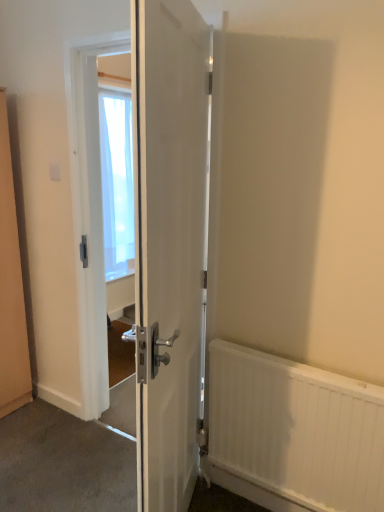
Measure the distance between transparent fabric at center and camera.

The depth of transparent fabric at center is 3.49 meters.

This screenshot has height=512, width=384. What do you see at coordinates (89, 211) in the screenshot?
I see `white glossy door at center` at bounding box center [89, 211].

I want to click on white glossy door at center, so coord(169,243).

What do you see at coordinates (54, 170) in the screenshot?
I see `white plastic electric outlet at upper left` at bounding box center [54, 170].

You are a GUI agent. You are given a task and a screenshot of the screen. Output one action in this format:
    pyautogui.click(x=<x>, y=<y>)
    Task: Click on the transparent fabric at center
    The image size is (384, 512).
    Given the screenshot: What is the action you would take?
    pyautogui.click(x=117, y=183)

Is the position of white glossy door at center less distant than that of white glossy door at center?

No, the depth of white glossy door at center is greater than that of white glossy door at center.

From a real-world perspective, is white glossy door at center physically below white glossy door at center?

No, from a real-world perspective, white glossy door at center is not under white glossy door at center.

Would you say white glossy door at center is a long distance from white glossy door at center?

No, white glossy door at center is not far from white glossy door at center.

Considering the relative sizes of white textured radiator at lower right and white glossy door at center in the image provided, is white textured radiator at lower right shorter than white glossy door at center?

Correct, white textured radiator at lower right is not as tall as white glossy door at center.

I want to click on door above the white textured radiator at lower right (from a real-world perspective), so click(x=169, y=243).

Is white textured radiator at lower right facing away from white glossy door at center?

No, white textured radiator at lower right is not facing the opposite direction of white glossy door at center.

Is white textured radiator at lower right behind white plastic electric outlet at upper left?

No, white textured radiator at lower right is closer to the camera.

From the image's perspective, between white textured radiator at lower right and white plastic electric outlet at upper left, who is located below?

white textured radiator at lower right appears lower in the image.

Is white textured radiator at lower right positioned beyond the bounds of white plastic electric outlet at upper left?

Yes, white textured radiator at lower right is outside of white plastic electric outlet at upper left.

From the image's perspective, is white glossy door at center above or below white plastic electric outlet at upper left?

From the image's perspective, white glossy door at center appears below white plastic electric outlet at upper left.

Can you confirm if white glossy door at center is shorter than white plastic electric outlet at upper left?

No, white glossy door at center is not shorter than white plastic electric outlet at upper left.

Between point (96, 304) and point (53, 163), which one is positioned in front?

The point (53, 163) is more forward.

Can you tell me how much white glossy door at center and transparent fabric at center differ in facing direction?

The angle between the facing direction of white glossy door at center and the facing direction of transparent fabric at center is 158 degrees.

From the image's perspective, is white glossy door at center positioned above or below transparent fabric at center?

From the image's perspective, white glossy door at center appears below transparent fabric at center.

Is white glossy door at center next to transparent fabric at center?

No, white glossy door at center is not in contact with transparent fabric at center.

How far apart are white glossy door at center and transparent fabric at center?

white glossy door at center is 7.39 feet away from transparent fabric at center.

Is transparent fabric at center spatially inside white plastic electric outlet at upper left, or outside of it?

transparent fabric at center is spatially situated outside white plastic electric outlet at upper left.

You are a GUI agent. You are given a task and a screenshot of the screen. Output one action in this format:
    pyautogui.click(x=<x>, y=<y>)
    Task: Click on the electric outlet on the left of transparent fabric at center
    The height and width of the screenshot is (512, 384).
    Given the screenshot: What is the action you would take?
    pyautogui.click(x=54, y=170)

Between point (132, 262) and point (53, 175), which one is positioned behind?

The point (53, 175) is farther from the camera.

From a real-world perspective, is transparent fabric at center positioned under white plastic electric outlet at upper left based on gravity?

Correct, in the physical world, transparent fabric at center is lower than white plastic electric outlet at upper left.

From a real-world perspective, which object stands above the other?

In real-world perspective, white plastic electric outlet at upper left is above.

Is white plastic electric outlet at upper left turned away from white glossy door at center?

white plastic electric outlet at upper left does not have its back to white glossy door at center.

Is white plastic electric outlet at upper left wider or thinner than white glossy door at center?

In the image, white plastic electric outlet at upper left appears to be more narrow than white glossy door at center.

Is white plastic electric outlet at upper left shorter than white glossy door at center?

Yes.

Where is `door in front of the white glossy door at center`? This screenshot has height=512, width=384. door in front of the white glossy door at center is located at coordinates (169, 243).

Identify the location of radiator that appears below the white glossy door at center (from the image's perspective). The width and height of the screenshot is (384, 512). [x=293, y=433].

Based on their spatial positions, is white plastic electric outlet at upper left or white glossy door at center further from white textured radiator at lower right?

white plastic electric outlet at upper left lies further to white textured radiator at lower right than the other object.

Looking at the image, which one is located further to transparent fabric at center, white plastic electric outlet at upper left or white textured radiator at lower right?

The object further to transparent fabric at center is white textured radiator at lower right.

Which object lies nearer to the anchor point white glossy door at center, transparent fabric at center or white plastic electric outlet at upper left?

white plastic electric outlet at upper left is closer to white glossy door at center.

Considering their positions, is white plastic electric outlet at upper left positioned closer to white glossy door at center than white textured radiator at lower right?

Among the two, white plastic electric outlet at upper left is located nearer to white glossy door at center.

When comparing their distances from white plastic electric outlet at upper left, does white glossy door at center or transparent fabric at center seem further?

transparent fabric at center is positioned further to the anchor white plastic electric outlet at upper left.

Looking at the image, which one is located further to white textured radiator at lower right, transparent fabric at center or white glossy door at center?

transparent fabric at center is positioned further to the anchor white textured radiator at lower right.

Estimate the real-world distances between objects in this image. Which object is closer to white plastic electric outlet at upper left, transparent fabric at center or white textured radiator at lower right?

transparent fabric at center lies closer to white plastic electric outlet at upper left than the other object.

Considering their positions, is white plastic electric outlet at upper left positioned further to white glossy door at center than transparent fabric at center?

The object further to white glossy door at center is transparent fabric at center.

This screenshot has width=384, height=512. Find the location of `screen door positioned between white glossy door at center and white plastic electric outlet at upper left from near to far`. screen door positioned between white glossy door at center and white plastic electric outlet at upper left from near to far is located at coordinates (89, 211).

Where is `radiator located between white glossy door at center and transparent fabric at center in the depth direction`? The width and height of the screenshot is (384, 512). radiator located between white glossy door at center and transparent fabric at center in the depth direction is located at coordinates (293, 433).

Where is `radiator positioned between white glossy door at center and white glossy door at center from near to far`? radiator positioned between white glossy door at center and white glossy door at center from near to far is located at coordinates (293, 433).

Identify the location of radiator between white glossy door at center and white plastic electric outlet at upper left along the z-axis. This screenshot has height=512, width=384. (293, 433).